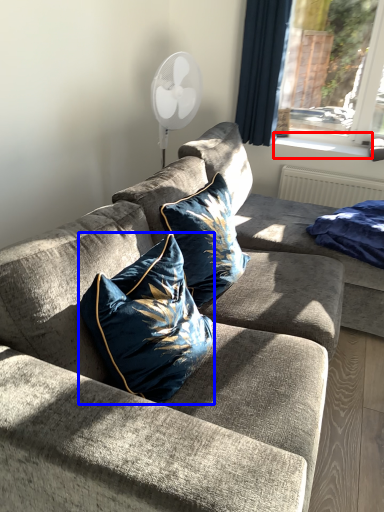
Question: Which point is further to the camera, window sill (highlighted by a red box) or pillow (highlighted by a blue box)?

Choices:
 (A) window sill
 (B) pillow

Answer: (A)